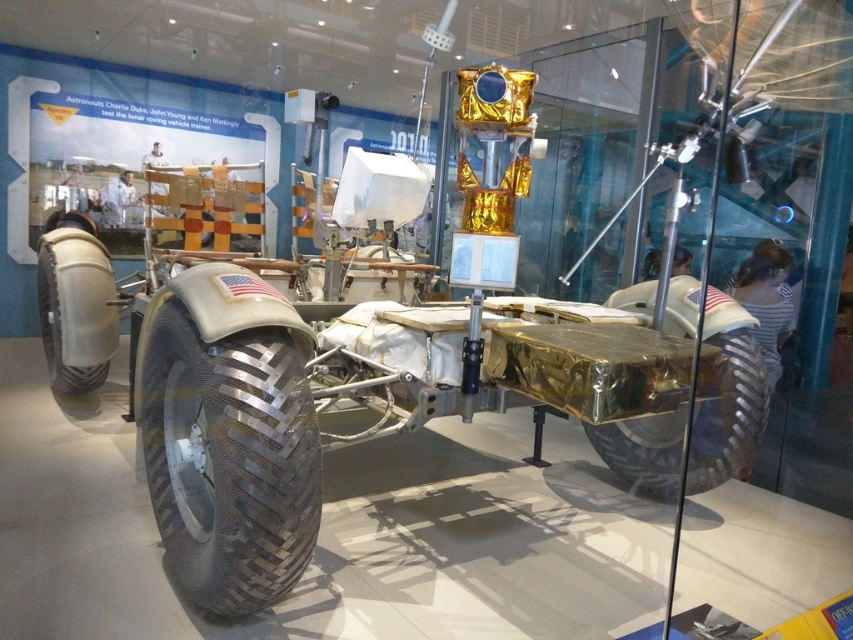
Is shiny metallic tire at lower right to the left of rubber/textured tire at lower left from the viewer's perspective?

In fact, shiny metallic tire at lower right is to the right of rubber/textured tire at lower left.

Who is more distant from viewer, (619,467) or (109,307)?

The point (109,307) is more distant.

The image size is (853, 640). I want to click on shiny metallic tire at lower right, so click(728, 416).

Locate an element on the screen. This screenshot has height=640, width=853. shiny metallic tire at lower right is located at coordinates (728, 416).

Does metallic silver tire at lower left have a lesser width compared to rubber/textured tire at lower left?

Correct, metallic silver tire at lower left's width is less than rubber/textured tire at lower left's.

Can you confirm if metallic silver tire at lower left is positioned to the right of rubber/textured tire at lower left?

Correct, you'll find metallic silver tire at lower left to the right of rubber/textured tire at lower left.

Locate an element on the screen. Image resolution: width=853 pixels, height=640 pixels. metallic silver tire at lower left is located at coordinates (229, 460).

Locate an element on the screen. The width and height of the screenshot is (853, 640). metallic silver tire at lower left is located at coordinates (229, 460).

Image resolution: width=853 pixels, height=640 pixels. Describe the element at coordinates (229, 460) in the screenshot. I see `metallic silver tire at lower left` at that location.

Is metallic silver tire at lower left to the right of shiny metallic tire at lower right from the viewer's perspective?

No, metallic silver tire at lower left is not to the right of shiny metallic tire at lower right.

This screenshot has height=640, width=853. Describe the element at coordinates (229, 460) in the screenshot. I see `metallic silver tire at lower left` at that location.

At what (x,y) coordinates should I click in order to perform the action: click on metallic silver tire at lower left. Please return your answer as a coordinate pair (x, y). This screenshot has height=640, width=853. Looking at the image, I should click on (229, 460).